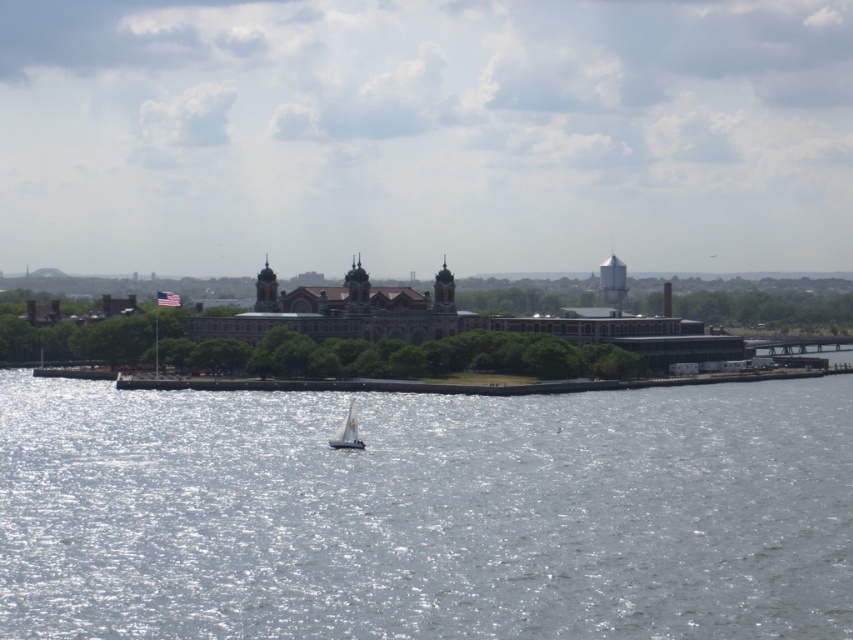
You are an observer standing on the dock and see the reflective silver water at center and the white sailboat at center. Which object is nearer to you?

The reflective silver water at center is closer to the viewer than the white sailboat at center.

You are a photographer planning to capture the historic building complex in the distance. You notice the reflective silver water at center and the white sailboat at center in your shot. Which object appears larger in the photo?

The reflective silver water at center appears larger in the photo because it is taller than the white sailboat at center.